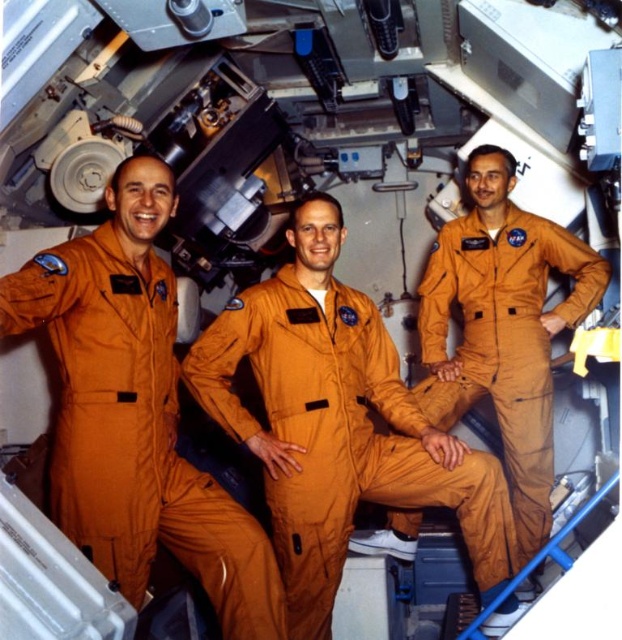
Is orange smooth jumpsuit at center positioned before orange fabric jumpsuit at center?

Yes, it is.

In order to click on orange smooth jumpsuit at center in this screenshot , I will do `click(134, 433)`.

Between point (67, 333) and point (251, 304), which one is positioned in front?

Positioned in front is point (67, 333).

Find the location of a particular element. The image size is (622, 640). orange smooth jumpsuit at center is located at coordinates (x=134, y=433).

Where is `orange smooth jumpsuit at center`? The image size is (622, 640). orange smooth jumpsuit at center is located at coordinates (134, 433).

Can you confirm if orange smooth jumpsuit at center is shorter than matte orange jumpsuit at center?

Yes, orange smooth jumpsuit at center is shorter than matte orange jumpsuit at center.

Who is more forward, (172, 330) or (432, 273)?

Positioned in front is point (172, 330).

Image resolution: width=622 pixels, height=640 pixels. What are the coordinates of `orange smooth jumpsuit at center` in the screenshot? It's located at (134, 433).

Does orange fabric jumpsuit at center have a smaller size compared to matte orange jumpsuit at center?

Correct, orange fabric jumpsuit at center occupies less space than matte orange jumpsuit at center.

Which is below, orange fabric jumpsuit at center or matte orange jumpsuit at center?

orange fabric jumpsuit at center is below.

I want to click on orange fabric jumpsuit at center, so [x=337, y=436].